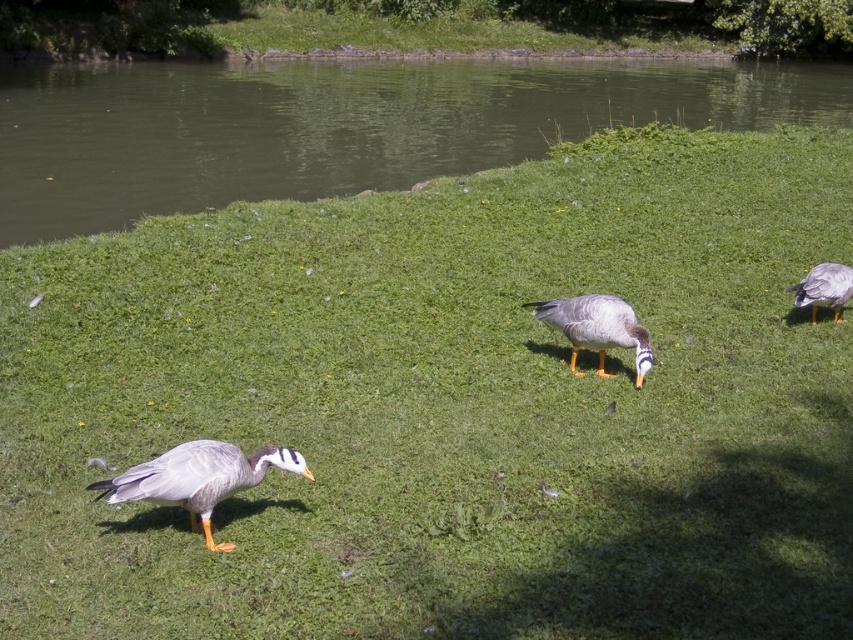
You are a photographer standing in front of the scene. You want to take a photo that includes both the green water at center and the gray matte duck at right. Which object should you adjust your camera focus to first to ensure both are in the frame?

Since the green water at center is closer to the viewer than the gray matte duck at right, you should focus on the green water at center first to ensure both are in the frame.

Based on the photo, you are standing at the edge of the water in the middle ground of the scene. You see a point marked at coordinates (596, 328). What object is located at that point?

The gray matte duck at center is located at point (596, 328).

You are a photographer aiming to capture a clear shot of the gray matte duck at center and the gray matte duck at right. Which duck is closer to the camera, and why?

The gray matte duck at center is closer to the camera because it is positioned in front of the gray matte duck at right.